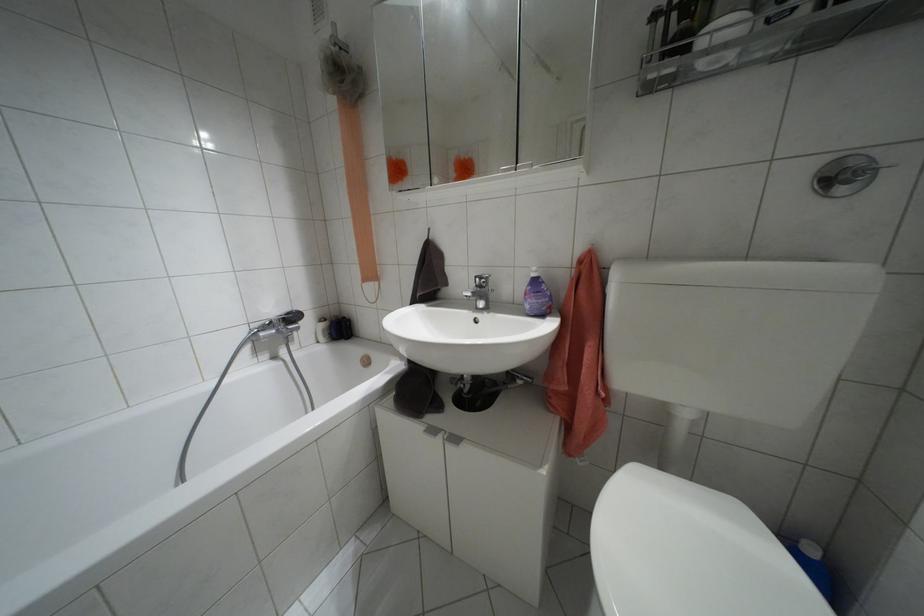
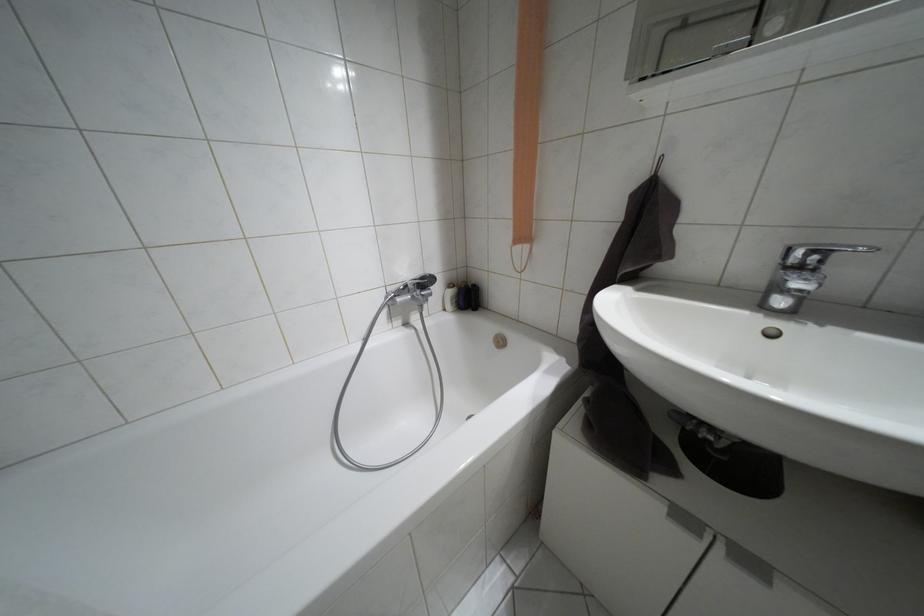
In the second image, find the point that corresponds to (432,430) in the first image.

(684, 517)